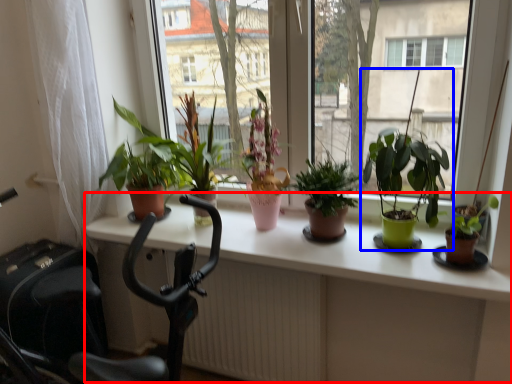
Question: Which point is closer to the camera, table (highlighted by a red box) or houseplant (highlighted by a blue box)?

Choices:
 (A) table
 (B) houseplant

Answer: (A)